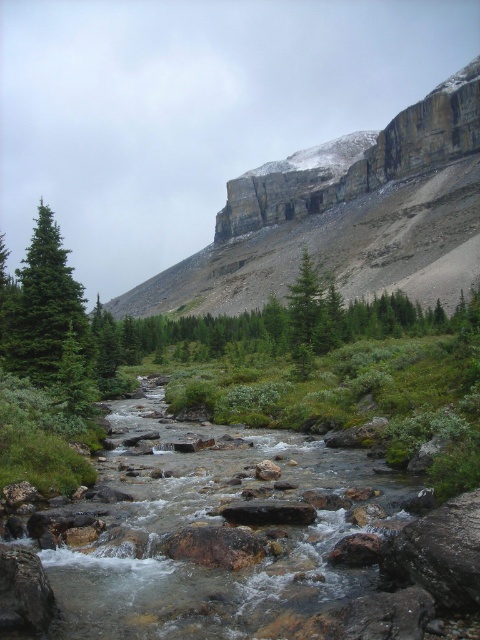
Question: Can you confirm if gray rocky cliff at upper right is positioned to the right of green matte evergreen tree at left?

Choices:
 (A) no
 (B) yes

Answer: (B)

Question: Which of the following is the closest to the observer?

Choices:
 (A) green matte evergreen tree at left
 (B) green matte evergreen tree at center
 (C) gray rocky cliff at upper right

Answer: (A)

Question: Does gray rocky cliff at upper right lie behind green matte evergreen tree at center?

Choices:
 (A) yes
 (B) no

Answer: (A)

Question: Which point is farther to the camera?

Choices:
 (A) green matte evergreen tree at left
 (B) gray rocky cliff at upper right

Answer: (B)

Question: In this image, where is gray rocky cliff at upper right located relative to green matte evergreen tree at center?

Choices:
 (A) left
 (B) right

Answer: (B)

Question: Based on their relative distances, which object is farther from the green matte evergreen tree at center?

Choices:
 (A) green matte evergreen tree at left
 (B) gray rocky cliff at upper right

Answer: (B)